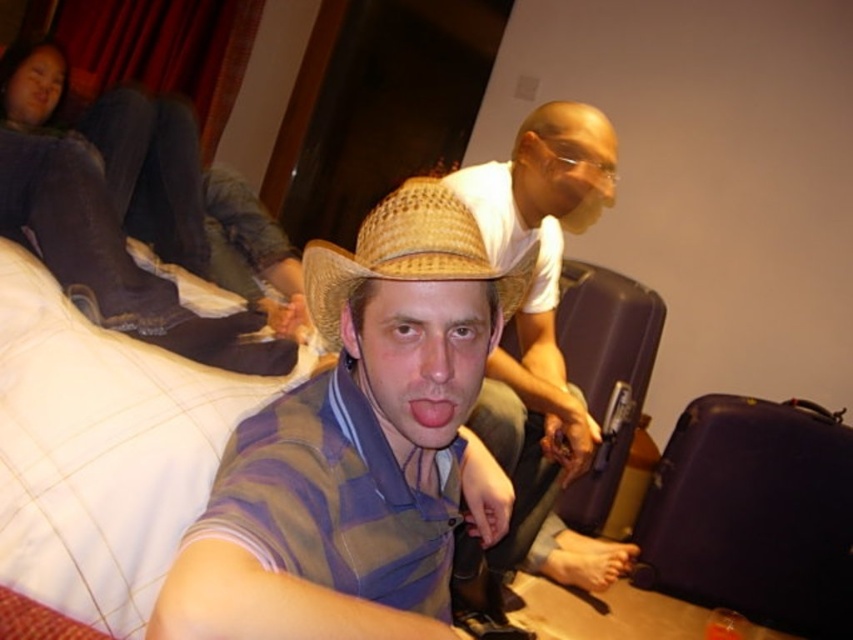
Is straw hat at center bigger than pink glossy lips at center?

Indeed, straw hat at center has a larger size compared to pink glossy lips at center.

Does straw hat at center appear under pink glossy lips at center?

Yes.

Is point (227, 608) closer to viewer compared to point (413, 400)?

Yes, it is in front of point (413, 400).

This screenshot has width=853, height=640. In order to click on straw hat at center in this screenshot , I will do `click(357, 445)`.

Between strawhat at center and pink glossy lips at center, which one is positioned higher?

strawhat at center is higher up.

Does point (393, 260) come in front of point (450, 416)?

Yes, point (393, 260) is closer to viewer.

Is point (428, 196) closer to viewer compared to point (437, 410)?

No, it is behind (437, 410).

Where is `strawhat at center`? This screenshot has height=640, width=853. strawhat at center is located at coordinates (408, 253).

Can you confirm if straw hat at center is thinner than purple matte suitcase at center?

Correct, straw hat at center's width is less than purple matte suitcase at center's.

Which is below, straw hat at center or purple matte suitcase at center?

purple matte suitcase at center is lower down.

Which is in front, point (427, 608) or point (650, 349)?

Point (427, 608) is more forward.

At what (x,y) coordinates should I click in order to perform the action: click on straw hat at center. Please return your answer as a coordinate pair (x, y). Looking at the image, I should click on (357, 445).